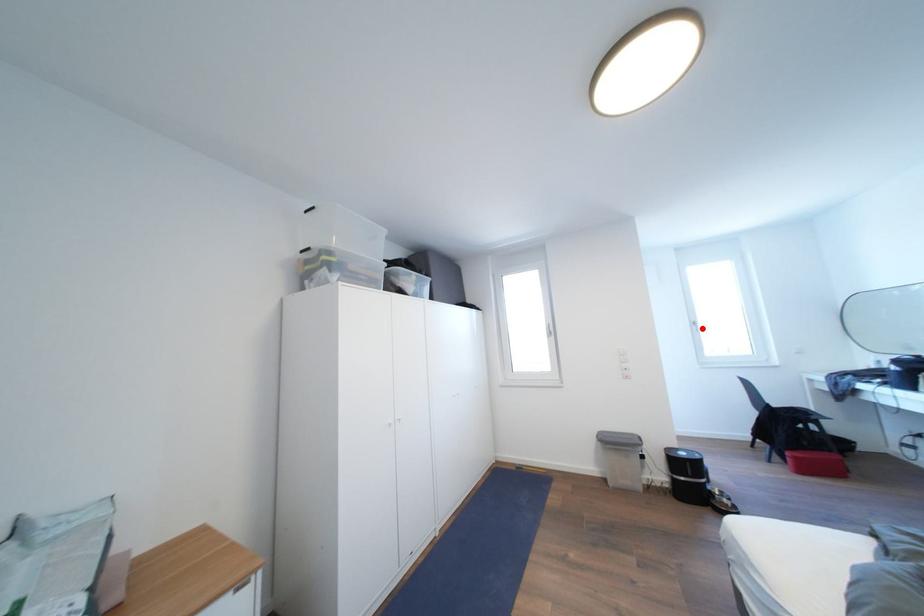
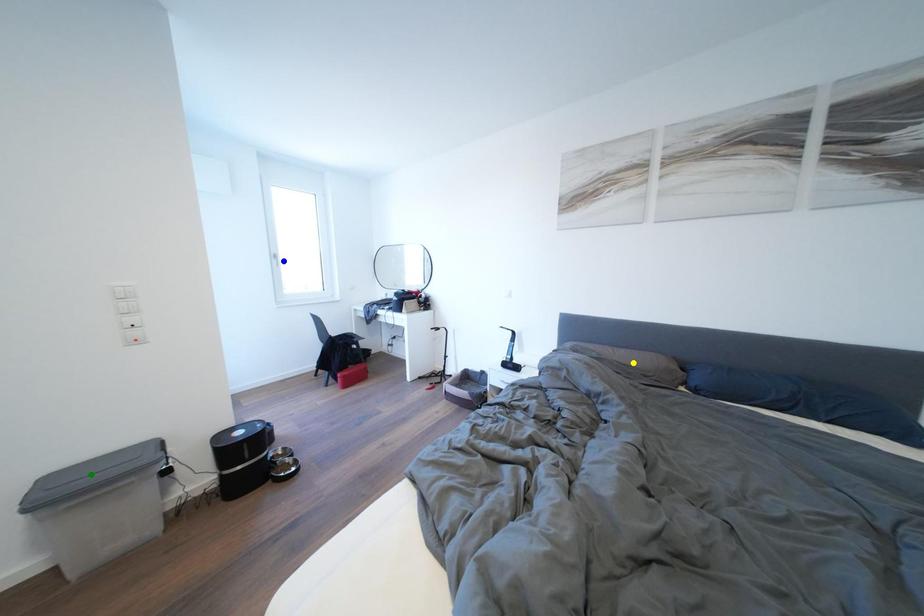
Question: I am providing you with two images of the same scene from different viewpoints. A red point is marked on the first image. You are given multiple points on the second image. In image 2, which mark is for the same physical point as the one in image 1?

Choices:
 (A) green point
 (B) blue point
 (C) yellow point

Answer: (B)